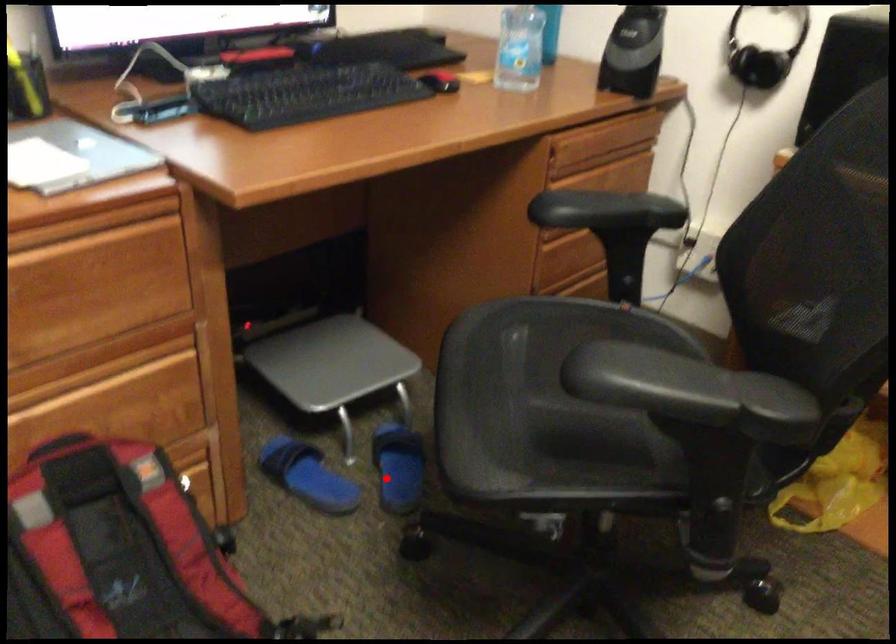
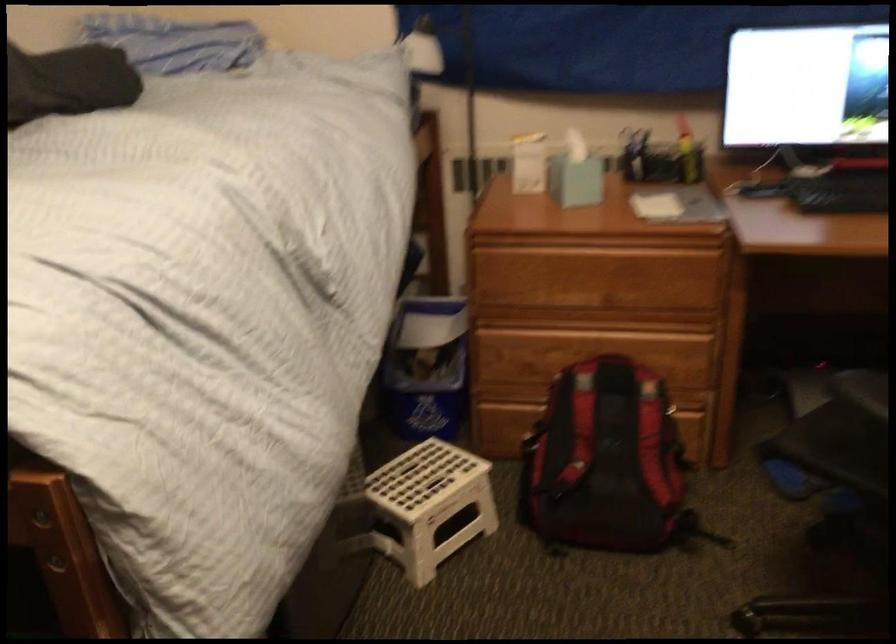
Question: I am providing you with two images of the same scene from different viewpoints. In image1, a red point is highlighted. Considering the same 3D point in image2, which of the following is correct?

Choices:
 (A) It is closer
 (B) It is farther

Answer: (B)